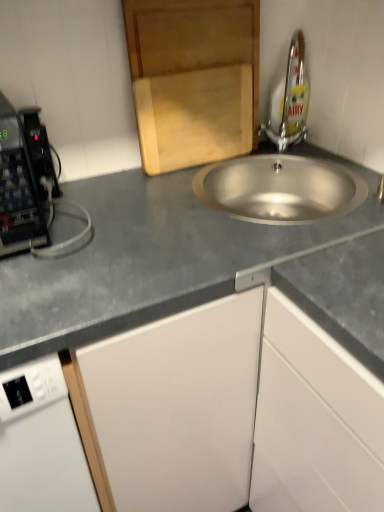
The width and height of the screenshot is (384, 512). Identify the location of white matte cabinet at lower right, the 1th cabinetry from the right. (315, 420).

Measure the distance between stainless steel sink at center and camera.

stainless steel sink at center and camera are 35.47 inches apart from each other.

This screenshot has width=384, height=512. What do you see at coordinates (126, 265) in the screenshot? I see `gray matte countertop at center` at bounding box center [126, 265].

The image size is (384, 512). Identify the location of silver metallic tap at upper right. (289, 100).

In order to click on sink behind the white matte cabinet at lower right, the 1th cabinetry from the right in this screenshot , I will do tap(280, 189).

Which is behind, point (297, 169) or point (264, 368)?

Positioned behind is point (297, 169).

From a real-world perspective, is stainless steel sink at center physically located above or below white matte cabinet at lower right, the 1th cabinetry from the right?

From a real-world perspective, stainless steel sink at center is physically above white matte cabinet at lower right, the 1th cabinetry from the right.

Looking at this image, can you tell me how much stainless steel sink at center and white matte cabinet at lower right, the second cabinetry viewed from the top, differ in facing direction?

49.9 degrees separate the facing orientations of stainless steel sink at center and white matte cabinet at lower right, the second cabinetry viewed from the top.

Between gray matte countertop at center and stainless steel sink at center, which one appears on the right side from the viewer's perspective?

stainless steel sink at center.

In terms of size, does gray matte countertop at center appear bigger or smaller than stainless steel sink at center?

gray matte countertop at center is bigger than stainless steel sink at center.

Would you say stainless steel sink at center is part of gray matte countertop at center's contents?

Indeed, stainless steel sink at center is located within gray matte countertop at center.

In terms of width, does stainless steel sink at center look wider or thinner when compared to gray matte countertop at center?

In the image, stainless steel sink at center appears to be more narrow than gray matte countertop at center.

Does stainless steel sink at center have a lesser height compared to gray matte countertop at center?

Yes, stainless steel sink at center is shorter than gray matte countertop at center.

Visually, is stainless steel sink at center positioned to the left or to the right of gray matte countertop at center?

stainless steel sink at center is positioned on gray matte countertop at center's right side.

Can you confirm if gray matte countertop at center is shorter than white matte cabinet at lower right, the second cabinetry viewed from the top?

Yes, gray matte countertop at center is shorter than white matte cabinet at lower right, the second cabinetry viewed from the top.

Based on the photo, who is smaller, gray matte countertop at center or white matte cabinet at lower right, the 1th cabinetry from the right?

white matte cabinet at lower right, the 1th cabinetry from the right.

Is gray matte countertop at center at the left side of white matte cabinet at lower right, the second cabinetry viewed from the top?

Correct, you'll find gray matte countertop at center to the left of white matte cabinet at lower right, the second cabinetry viewed from the top.

Can you tell me how much gray matte countertop at center and white matte cabinet at lower right, which appears as the first cabinetry when ordered from the bottom, differ in facing direction?

The facing directions of gray matte countertop at center and white matte cabinet at lower right, which appears as the first cabinetry when ordered from the bottom, are 8.89e-05 degrees apart.

In the scene shown: Can you confirm if white matte cabinet at lower right, the second cabinetry viewed from the top, is smaller than wooden cutting board at upper center, the 1th cabinetry positioned from the left?

No.

From the image's perspective, which one is positioned lower, white matte cabinet at lower right, the second cabinetry viewed from the top, or wooden cutting board at upper center, arranged as the 2th cabinetry when viewed from the right?

white matte cabinet at lower right, the second cabinetry viewed from the top.

Considering the relative positions of white matte cabinet at lower right, which appears as the first cabinetry when ordered from the bottom, and wooden cutting board at upper center, which is the second cabinetry in bottom-to-top order, in the image provided, is white matte cabinet at lower right, which appears as the first cabinetry when ordered from the bottom, behind wooden cutting board at upper center, which is the second cabinetry in bottom-to-top order,?

No, white matte cabinet at lower right, which appears as the first cabinetry when ordered from the bottom, is closer to the camera.

From a real-world perspective, between silver metallic tap at upper right and wooden cutting board at upper center, arranged as the 2th cabinetry when viewed from the right, who is vertically lower?

silver metallic tap at upper right, from a real-world perspective.

Consider the image. Does silver metallic tap at upper right have a lesser height compared to wooden cutting board at upper center, the 1th cabinetry positioned from the top?

Correct, silver metallic tap at upper right is not as tall as wooden cutting board at upper center, the 1th cabinetry positioned from the top.

Would you consider silver metallic tap at upper right to be distant from wooden cutting board at upper center, arranged as the 2th cabinetry when viewed from the right?

silver metallic tap at upper right is near wooden cutting board at upper center, arranged as the 2th cabinetry when viewed from the right, not far away.

Is silver metallic tap at upper right positioned beyond the bounds of white matte cabinet at lower right, the second cabinetry viewed from the top?

That's correct, silver metallic tap at upper right is outside of white matte cabinet at lower right, the second cabinetry viewed from the top.

Considering the points (288, 81) and (277, 449), which point is behind, point (288, 81) or point (277, 449)?

The point (288, 81) is behind.

This screenshot has height=512, width=384. I want to click on tap above the white matte cabinet at lower right, the 1th cabinetry from the right (from the image's perspective), so click(x=289, y=100).

In order to click on sink on the left of white matte cabinet at lower right, the second cabinetry from the left in this screenshot , I will do `click(280, 189)`.

You are a GUI agent. You are given a task and a screenshot of the screen. Output one action in this format:
    pyautogui.click(x=<x>, y=<y>)
    Task: Click on the countertop in front of the stainless steel sink at center
    The width and height of the screenshot is (384, 512).
    Given the screenshot: What is the action you would take?
    pyautogui.click(x=126, y=265)

From the image, which object appears to be farther from stainless steel sink at center, wooden cutting board at upper center, the 1th cabinetry positioned from the top, or white matte cabinet at lower right, which appears as the first cabinetry when ordered from the bottom?

Based on the image, white matte cabinet at lower right, which appears as the first cabinetry when ordered from the bottom, appears to be further to stainless steel sink at center.

Which object lies further to the anchor point white matte cabinet at lower right, the second cabinetry from the left, silver metallic tap at upper right or stainless steel sink at center?

silver metallic tap at upper right.

Based on their spatial positions, is white matte cabinet at lower right, the second cabinetry viewed from the top, or silver metallic tap at upper right closer to gray matte countertop at center?

white matte cabinet at lower right, the second cabinetry viewed from the top, lies closer to gray matte countertop at center than the other object.

From the image, which object appears to be farther from stainless steel sink at center, white matte cabinet at lower right, the second cabinetry from the left, or wooden cutting board at upper center, the 1th cabinetry positioned from the left?

white matte cabinet at lower right, the second cabinetry from the left, is positioned further to the anchor stainless steel sink at center.

Looking at the image, which one is located closer to gray matte countertop at center, white matte cabinet at lower right, the second cabinetry from the left, or wooden cutting board at upper center, the 1th cabinetry positioned from the top?

white matte cabinet at lower right, the second cabinetry from the left, lies closer to gray matte countertop at center than the other object.

Looking at the image, which one is located further to wooden cutting board at upper center, which is the second cabinetry in bottom-to-top order, gray matte countertop at center or stainless steel sink at center?

The object further to wooden cutting board at upper center, which is the second cabinetry in bottom-to-top order, is gray matte countertop at center.

Looking at the image, which one is located closer to silver metallic tap at upper right, gray matte countertop at center or stainless steel sink at center?

stainless steel sink at center lies closer to silver metallic tap at upper right than the other object.

Looking at the image, which one is located closer to white matte cabinet at lower right, the 1th cabinetry from the right, stainless steel sink at center or wooden cutting board at upper center, which is the second cabinetry in bottom-to-top order?

The object closer to white matte cabinet at lower right, the 1th cabinetry from the right, is stainless steel sink at center.

Identify the location of sink between wooden cutting board at upper center, arranged as the 2th cabinetry when viewed from the right, and white matte cabinet at lower right, which appears as the first cabinetry when ordered from the bottom, vertically. The height and width of the screenshot is (512, 384). (280, 189).

The image size is (384, 512). I want to click on countertop that lies between wooden cutting board at upper center, the 1th cabinetry positioned from the left, and white matte cabinet at lower right, the second cabinetry viewed from the top, from top to bottom, so click(126, 265).

I want to click on sink between silver metallic tap at upper right and gray matte countertop at center in the up-down direction, so click(280, 189).

Locate an element on the screen. sink between silver metallic tap at upper right and white matte cabinet at lower right, the 1th cabinetry from the right, in the up-down direction is located at coordinates (280, 189).